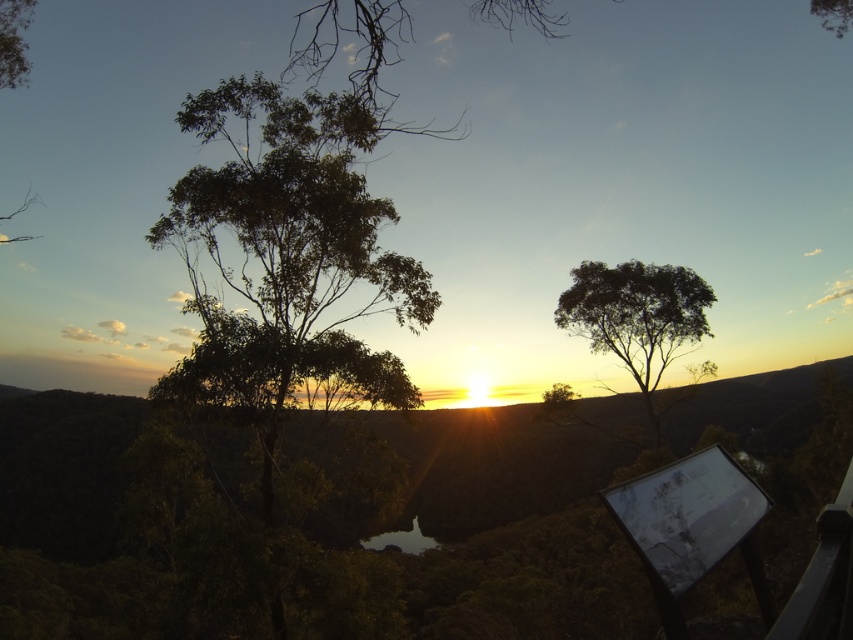
Question: Is green leafy tree at left smaller than green leafy tree at center?

Choices:
 (A) yes
 (B) no

Answer: (A)

Question: Does green leafy tree at left come behind green leafy tree at center?

Choices:
 (A) yes
 (B) no

Answer: (B)

Question: Among these objects, which one is farthest from the camera?

Choices:
 (A) green leafy tree at left
 (B) green leafy tree at center

Answer: (B)

Question: Does green leafy tree at left appear on the left side of green leafy tree at center?

Choices:
 (A) no
 (B) yes

Answer: (B)